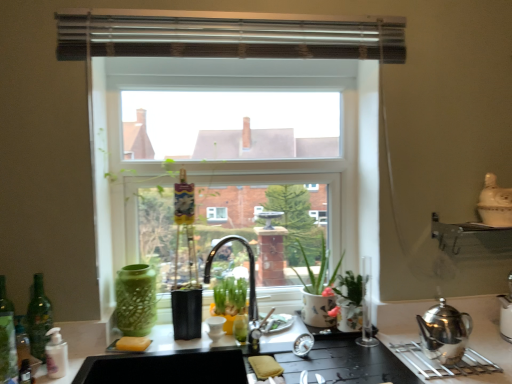
You are a GUI agent. You are given a task and a screenshot of the screen. Output one action in this format:
    pyautogui.click(x=<x>, y=<y>)
    Task: Click on the free location to the right of yellow matte sponge at lower center
    Image resolution: width=512 pixels, height=384 pixels.
    Given the screenshot: What is the action you would take?
    pyautogui.click(x=173, y=346)